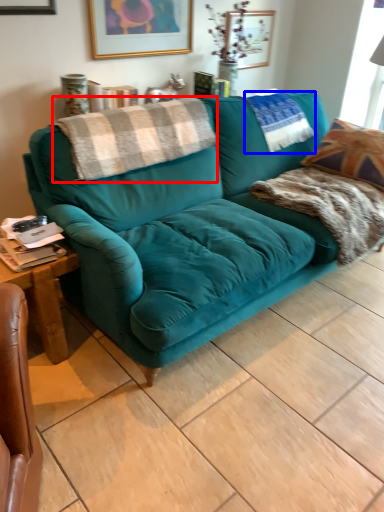
Question: Which point is further to the camera, blanket (highlighted by a red box) or pillow (highlighted by a blue box)?

Choices:
 (A) blanket
 (B) pillow

Answer: (B)